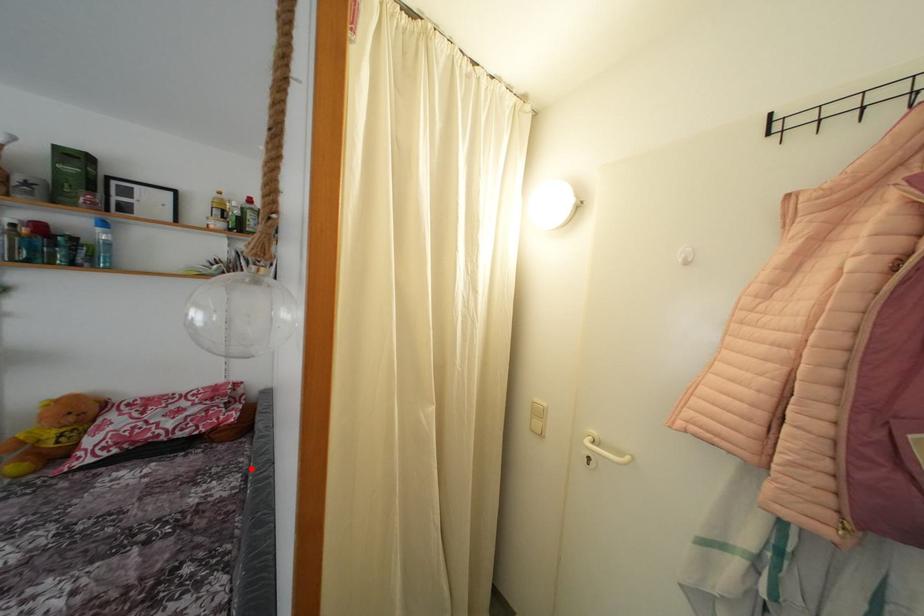
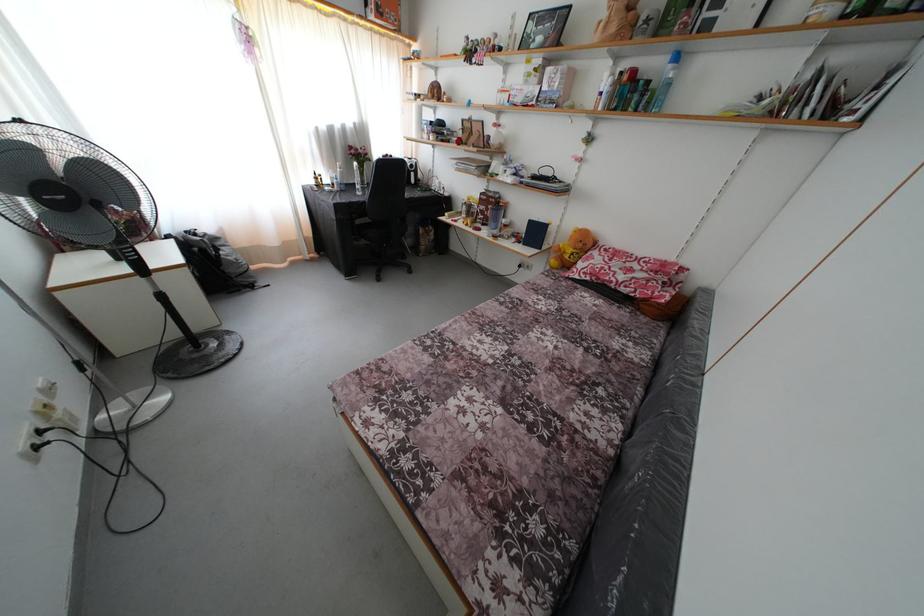
The point at the highlighted location is marked in the first image. Where is the corresponding point in the second image?

(663, 353)